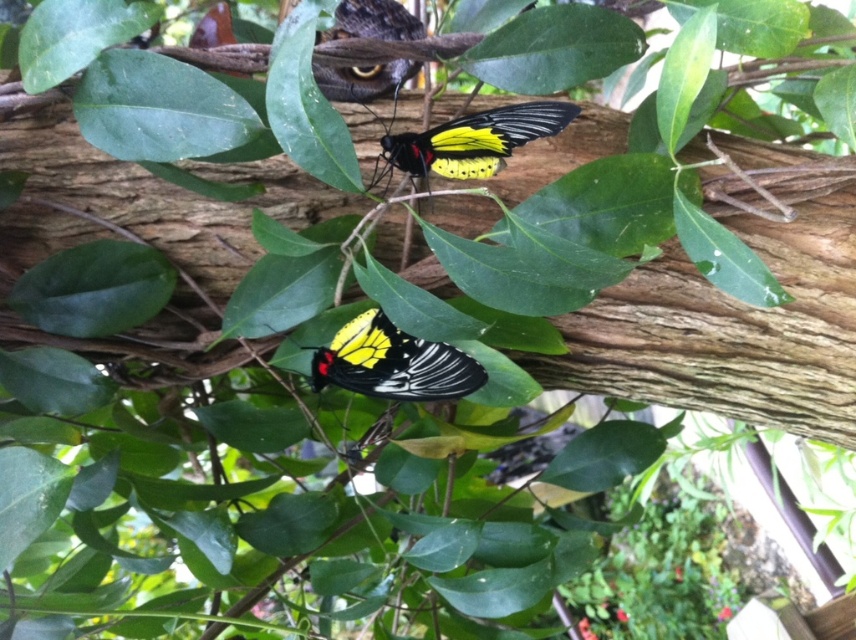
Question: Does yellow-black glossy butterfly at center have a greater width compared to yellow-black winged butterfly at center?

Choices:
 (A) yes
 (B) no

Answer: (B)

Question: Does yellow-black glossy butterfly at center appear under yellow-black winged butterfly at center?

Choices:
 (A) yes
 (B) no

Answer: (A)

Question: Is yellow-black glossy butterfly at center to the right of yellow-black winged butterfly at center from the viewer's perspective?

Choices:
 (A) yes
 (B) no

Answer: (B)

Question: Which point appears farthest from the camera in this image?

Choices:
 (A) (415, 138)
 (B) (337, 369)

Answer: (B)

Question: Which of the following is the closest to the observer?

Choices:
 (A) yellow-black winged butterfly at center
 (B) yellow-black glossy butterfly at center

Answer: (A)